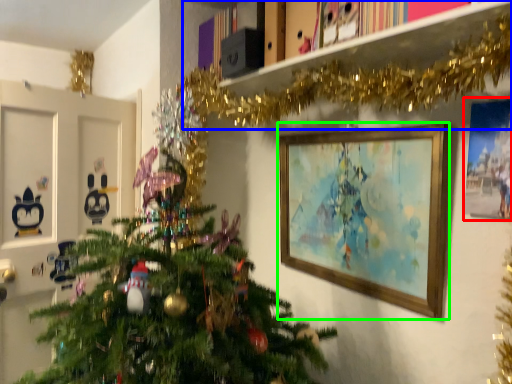
Question: Which object is positioned closest to picture frame (highlighted by a red box)? Select from bookshelf (highlighted by a blue box) and picture frame (highlighted by a green box).

Choices:
 (A) bookshelf
 (B) picture frame

Answer: (B)